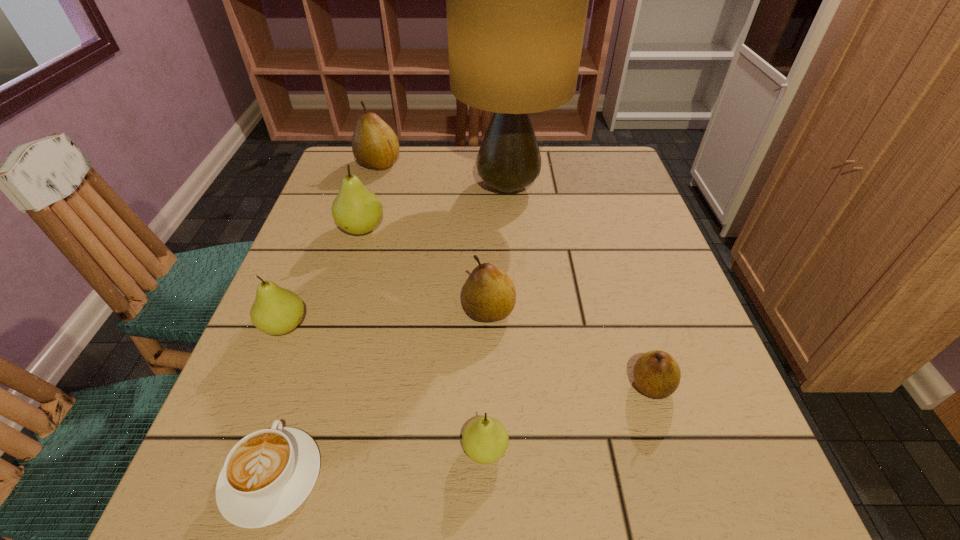
Image resolution: width=960 pixels, height=540 pixels. I want to click on free space that satisfies the following two spatial constraints: 1. on the front side of the sixth farthest object; 2. on the right side of the leftmost brown pear, so click(x=311, y=385).